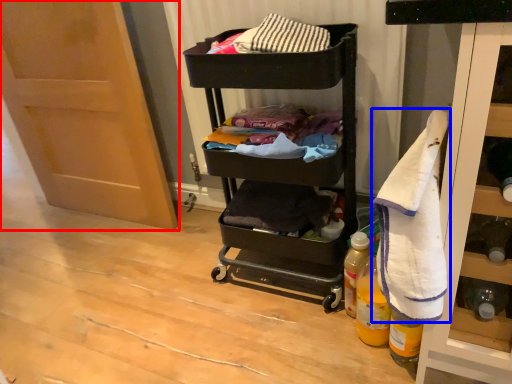
Question: Which object is further to the camera taking this photo, door (highlighted by a red box) or bath towel (highlighted by a blue box)?

Choices:
 (A) door
 (B) bath towel

Answer: (A)